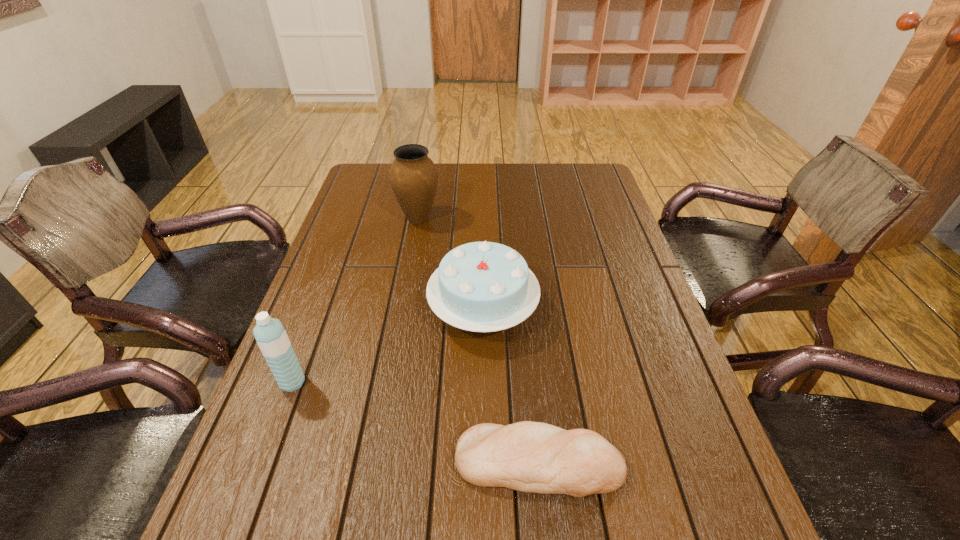
Where is `vacant space located 0.140m on the right of the shortest object`? The width and height of the screenshot is (960, 540). vacant space located 0.140m on the right of the shortest object is located at coordinates (697, 463).

This screenshot has height=540, width=960. What are the coordinates of `object at the left edge` in the screenshot? It's located at (270, 335).

You are a GUI agent. You are given a task and a screenshot of the screen. Output one action in this format:
    pyautogui.click(x=<x>, y=<y>)
    Task: Click on the vacant area at the far edge of the desktop
    
    Given the screenshot: What is the action you would take?
    pyautogui.click(x=454, y=187)

This screenshot has width=960, height=540. Identify the location of free spot at the left edge of the desktop. (375, 221).

You are a GUI agent. You are given a task and a screenshot of the screen. Output one action in this format:
    pyautogui.click(x=<x>, y=<y>)
    Task: Click on the vacant area at the right edge of the desktop
    
    Given the screenshot: What is the action you would take?
    pyautogui.click(x=596, y=224)

Find the location of a particular element. Image resolution: width=960 pixels, height=540 pixels. free spot between the third nearest object and the second nearest object is located at coordinates click(388, 346).

Find the location of a particular element. The height and width of the screenshot is (540, 960). empty space that is in between the shortest object and the farthest object is located at coordinates (478, 341).

Image resolution: width=960 pixels, height=540 pixels. What are the coordinates of `blank region between the nearest object and the birthday cake` in the screenshot? It's located at (511, 386).

Find the location of a particular element. The image size is (960, 540). unoccupied position between the water bottle and the second shortest object is located at coordinates (388, 346).

The image size is (960, 540). I want to click on empty space that is in between the nearest object and the leftmost object, so click(416, 423).